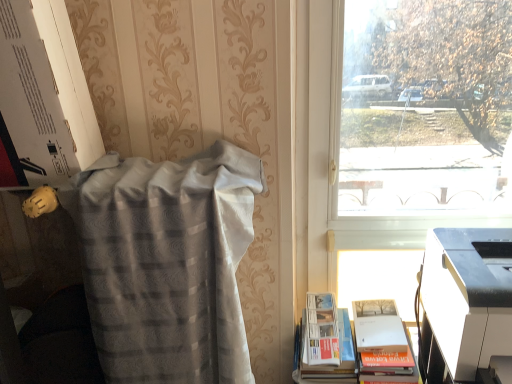
Question: Should I look upward or downward to see white paperback book at lower right?

Choices:
 (A) up
 (B) down

Answer: (B)

Question: From a real-world perspective, is white paperback book at lower right physically below white plastic printer at lower right?

Choices:
 (A) yes
 (B) no

Answer: (A)

Question: Is white paperback book at lower right oriented towards white plastic printer at lower right?

Choices:
 (A) no
 (B) yes

Answer: (A)

Question: Considering the relative sizes of white paperback book at lower right and white plastic printer at lower right in the image provided, is white paperback book at lower right smaller than white plastic printer at lower right?

Choices:
 (A) yes
 (B) no

Answer: (B)

Question: Is white paperback book at lower right thinner than white plastic printer at lower right?

Choices:
 (A) yes
 (B) no

Answer: (A)

Question: Is white paperback book at lower right positioned behind white plastic printer at lower right?

Choices:
 (A) no
 (B) yes

Answer: (B)

Question: Are white paperback book at lower right and white plastic printer at lower right beside each other?

Choices:
 (A) yes
 (B) no

Answer: (B)

Question: Is white plastic printer at lower right not within white paperback book at lower right?

Choices:
 (A) no
 (B) yes

Answer: (B)

Question: Is white plastic printer at lower right at the left side of white paperback book at lower right?

Choices:
 (A) no
 (B) yes

Answer: (A)

Question: Is white plastic printer at lower right oriented away from white paperback book at lower right?

Choices:
 (A) no
 (B) yes

Answer: (A)

Question: From a real-world perspective, is white plastic printer at lower right positioned under white paperback book at lower right based on gravity?

Choices:
 (A) no
 (B) yes

Answer: (A)

Question: Is white plastic printer at lower right facing towards white paperback book at lower right?

Choices:
 (A) no
 (B) yes

Answer: (A)

Question: Does white plastic printer at lower right have a smaller size compared to white paperback book at lower right?

Choices:
 (A) no
 (B) yes

Answer: (B)

Question: Is transparent glass window at upper right shorter than silvery textured blanket at left?

Choices:
 (A) no
 (B) yes

Answer: (A)